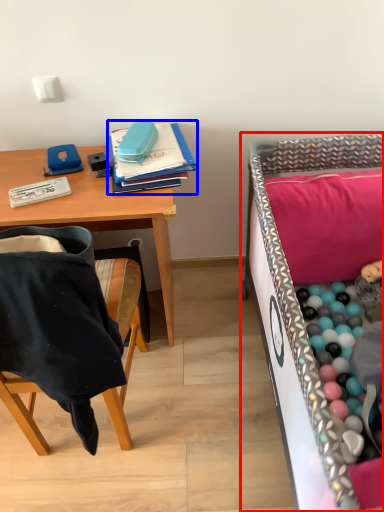
Question: Which point is closer to the camera, infant bed (highlighted by a red box) or notebook (highlighted by a blue box)?

Choices:
 (A) infant bed
 (B) notebook

Answer: (A)